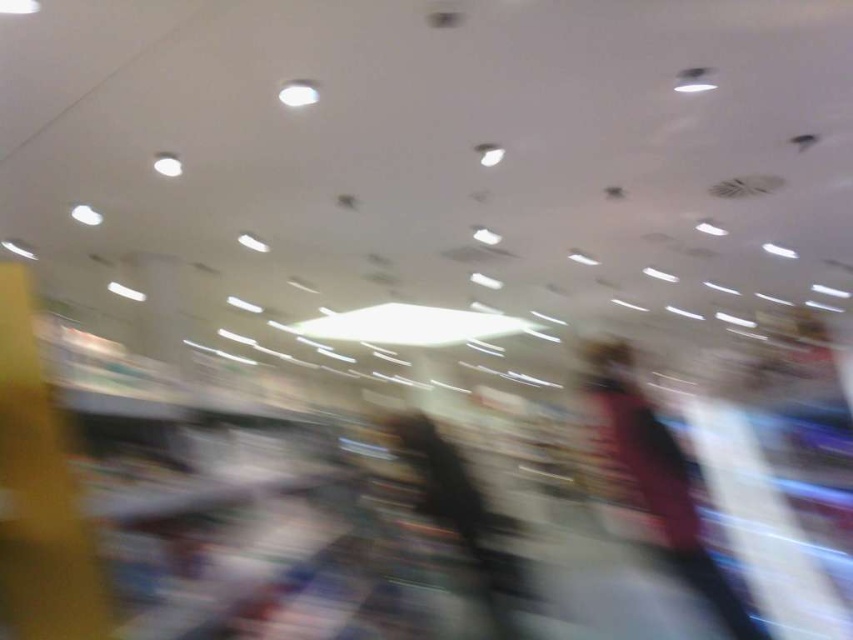
Question: Is dark pink fabric at center smaller than dark gray fabric jacket at center?

Choices:
 (A) yes
 (B) no

Answer: (A)

Question: Is dark pink fabric at center above dark gray fabric jacket at center?

Choices:
 (A) no
 (B) yes

Answer: (B)

Question: Which point is farther from the camera taking this photo?

Choices:
 (A) (718, 609)
 (B) (483, 566)

Answer: (B)

Question: Which object is closer to the camera taking this photo?

Choices:
 (A) dark pink fabric at center
 (B) dark gray fabric jacket at center

Answer: (A)

Question: Can you confirm if dark pink fabric at center is positioned below dark gray fabric jacket at center?

Choices:
 (A) yes
 (B) no

Answer: (B)

Question: Which object appears closest to the camera in this image?

Choices:
 (A) dark pink fabric at center
 (B) dark gray fabric jacket at center

Answer: (A)